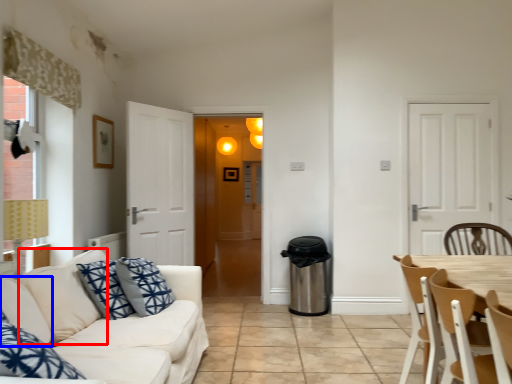
Question: Which object appears closest to the camera in this image, pillow (highlighted by a red box) or pillow (highlighted by a blue box)?

Choices:
 (A) pillow
 (B) pillow

Answer: (A)